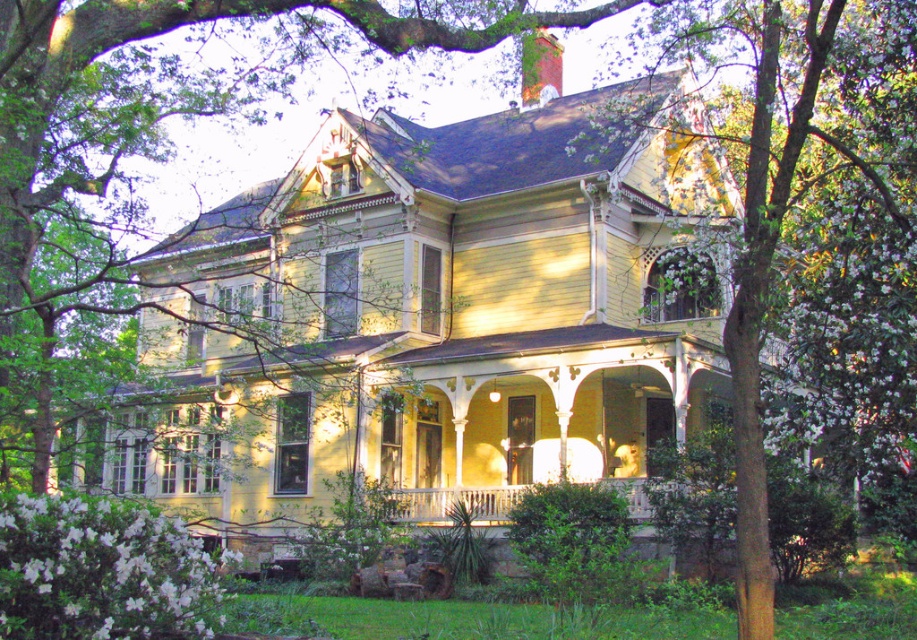
You are a landscape architect designing a garden around the house. You need to place a large statue that requires 3 meters of space. Considering the green leafy tree at center and the white wooden porch at center, which one has enough space around it to accommodate the statue?

The white wooden porch at center has enough space because it is wider than the green leafy tree at center, which is narrower and may not provide sufficient space for the statue.

You are a painter standing at the edge of the property, planning to paint the house. You notice the green leafy tree at center and the white wooden porch at center. Which object should you focus on first to ensure the tree doesn t block the porch in your painting?

You should focus on painting the green leafy tree at center first because it is taller than the white wooden porch at center and could cast shadows or block the view of the porch if not positioned correctly.